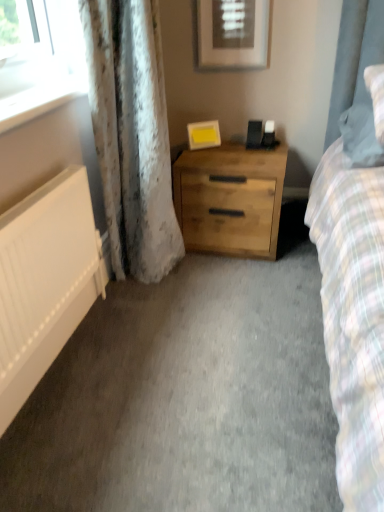
Question: Is white matte radiator at left not near white glossy window sill at upper left?

Choices:
 (A) no
 (B) yes

Answer: (A)

Question: Is white glossy window sill at upper left completely or partially inside white matte radiator at left?

Choices:
 (A) no
 (B) yes

Answer: (A)

Question: Can you confirm if white matte radiator at left is positioned to the left of white glossy window sill at upper left?

Choices:
 (A) yes
 (B) no

Answer: (B)

Question: Considering the relative sizes of white matte radiator at left and white glossy window sill at upper left in the image provided, is white matte radiator at left thinner than white glossy window sill at upper left?

Choices:
 (A) no
 (B) yes

Answer: (B)

Question: Does white matte radiator at left have a lesser height compared to white glossy window sill at upper left?

Choices:
 (A) yes
 (B) no

Answer: (B)

Question: Is white matte radiator at left closer to the viewer compared to white glossy window sill at upper left?

Choices:
 (A) yes
 (B) no

Answer: (A)

Question: Is white glossy window sill at upper left beside natural wood chest of drawers at center?

Choices:
 (A) no
 (B) yes

Answer: (A)

Question: Is white glossy window sill at upper left taller than natural wood chest of drawers at center?

Choices:
 (A) no
 (B) yes

Answer: (A)

Question: Does white glossy window sill at upper left turn towards natural wood chest of drawers at center?

Choices:
 (A) no
 (B) yes

Answer: (A)

Question: Can you confirm if white glossy window sill at upper left is smaller than natural wood chest of drawers at center?

Choices:
 (A) yes
 (B) no

Answer: (A)

Question: Can you confirm if white glossy window sill at upper left is positioned to the left of natural wood chest of drawers at center?

Choices:
 (A) yes
 (B) no

Answer: (A)

Question: Is white glossy window sill at upper left further to the viewer compared to natural wood chest of drawers at center?

Choices:
 (A) yes
 (B) no

Answer: (B)

Question: Is matte white picture frame at upper center, the 2th picture frame positioned from the bottom, positioned before natural wood chest of drawers at center?

Choices:
 (A) no
 (B) yes

Answer: (B)